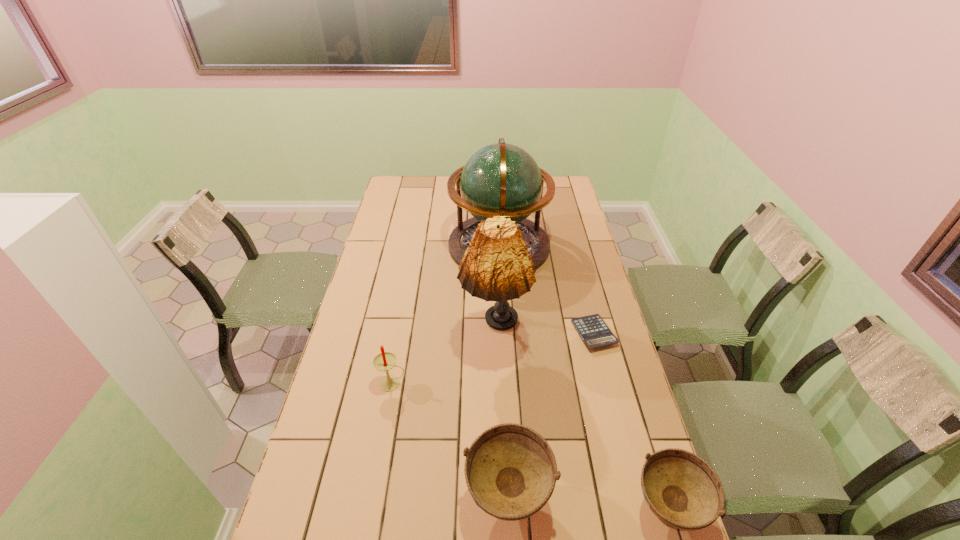
You are a GUI agent. You are given a task and a screenshot of the screen. Output one action in this format:
    pyautogui.click(x=<x>, y=<y>)
    Task: Click on the vacant region located 0.210m on the front of the leftmost object
    
    Given the screenshot: What is the action you would take?
    pyautogui.click(x=378, y=461)

Where is `object that is at the left edge`? This screenshot has height=540, width=960. object that is at the left edge is located at coordinates (384, 361).

At what (x,y) coordinates should I click in order to perform the action: click on calculator that is at the right edge. Please return your answer as a coordinate pair (x, y). This screenshot has height=540, width=960. Looking at the image, I should click on (593, 330).

Identify the location of globe that is at the right edge. The image size is (960, 540). (501, 179).

Image resolution: width=960 pixels, height=540 pixels. What are the coordinates of `vacant area at the near edge` in the screenshot? It's located at (424, 513).

The height and width of the screenshot is (540, 960). Identify the location of vacant space at the left edge of the desktop. (388, 232).

The image size is (960, 540). Find the location of `vacant space at the right edge`. vacant space at the right edge is located at coordinates (573, 225).

The height and width of the screenshot is (540, 960). In order to click on free space at the far left corner of the desktop in this screenshot , I will do pos(412,198).

The height and width of the screenshot is (540, 960). What are the coordinates of `free space at the far right corner of the desktop` in the screenshot? It's located at (559, 188).

At what (x,y) coordinates should I click in order to perform the action: click on vacant point located between the leftmost object and the lampshade. Please return your answer as a coordinate pair (x, y). This screenshot has height=540, width=960. Looking at the image, I should click on (444, 360).